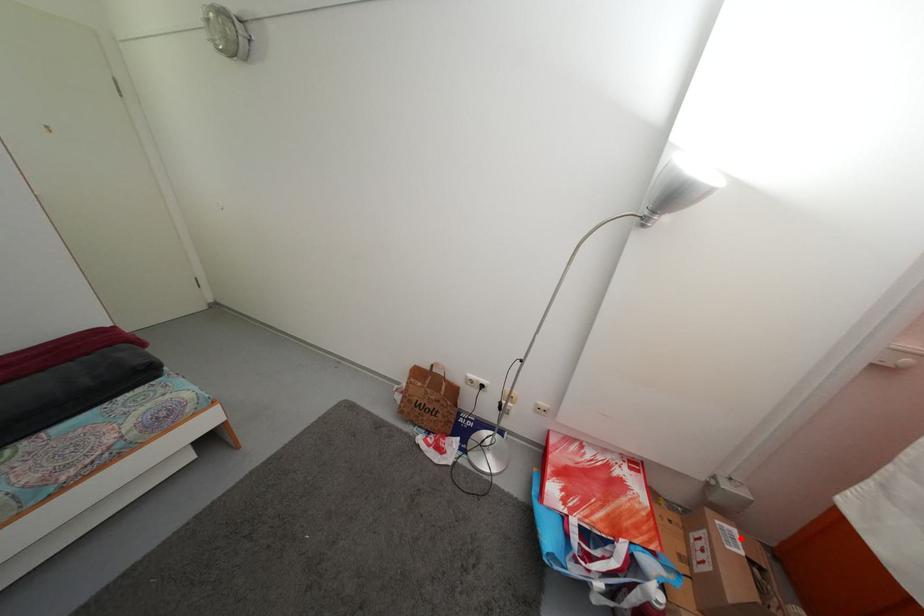
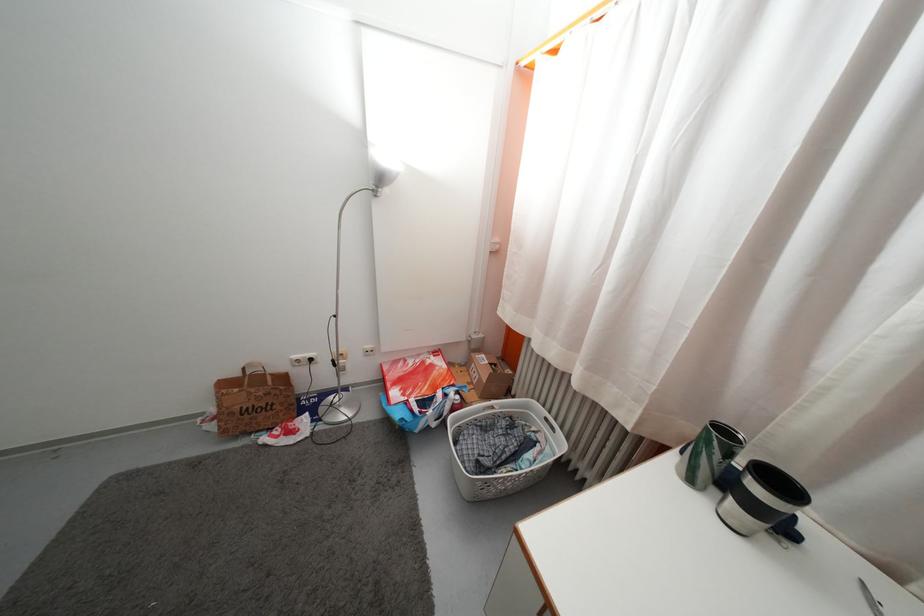
Find the pixel in the second image that matches the highlighted location in the first image.

(489, 363)